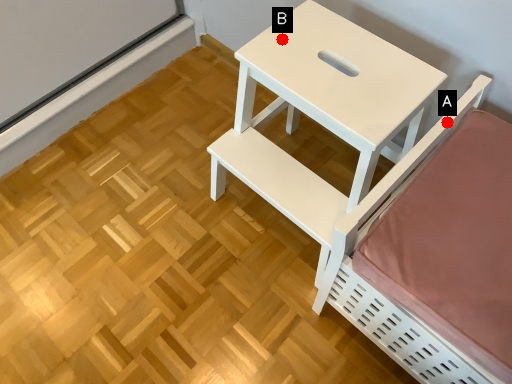
Question: Two points are circled on the image, labeled by A and B beside each circle. Which of the following is the closest to the observer?

Choices:
 (A) A is closer
 (B) B is closer

Answer: (A)